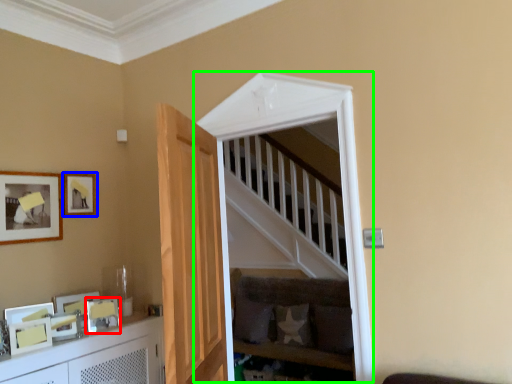
Question: Estimate the real-world distances between objects in this image. Which object is closer to picture frame (highlighted by a red box), picture frame (highlighted by a blue box) or window (highlighted by a green box)?

Choices:
 (A) picture frame
 (B) window

Answer: (A)